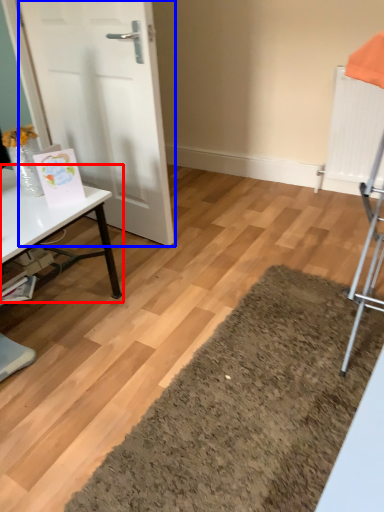
Question: Which object is closer to the camera taking this photo, table (highlighted by a red box) or door (highlighted by a blue box)?

Choices:
 (A) table
 (B) door

Answer: (A)